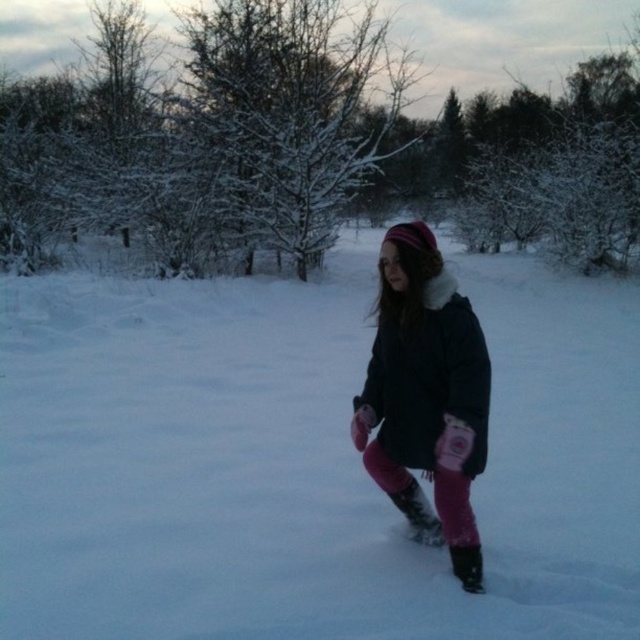
From the picture: Measure the distance from white fluffy snow at center to black matte boot at lower center.

white fluffy snow at center and black matte boot at lower center are 8.93 feet apart from each other.

Between white fluffy snow at center and black matte boot at lower center, which one is positioned lower?

black matte boot at lower center

Is point (618, 404) less distant than point (468, 564)?

No, it is not.

I want to click on white fluffy snow at center, so click(304, 460).

Does point (454, 385) lie in front of point (417, 525)?

Yes, point (454, 385) is closer to viewer.

Between pink fleece pants at center and matte black boot at center, which one is positioned higher?

Positioned higher is pink fleece pants at center.

The width and height of the screenshot is (640, 640). Identify the location of pink fleece pants at center. (424, 387).

Does white fluffy snow at center have a lesser width compared to matte black boot at center?

Incorrect, white fluffy snow at center's width is not less than matte black boot at center's.

Can you confirm if white fluffy snow at center is positioned to the left of matte black boot at center?

In fact, white fluffy snow at center is to the right of matte black boot at center.

Who is more distant from viewer, (x=301, y=332) or (x=408, y=516)?

The point (x=301, y=332) is more distant.

I want to click on white fluffy snow at center, so click(x=304, y=460).